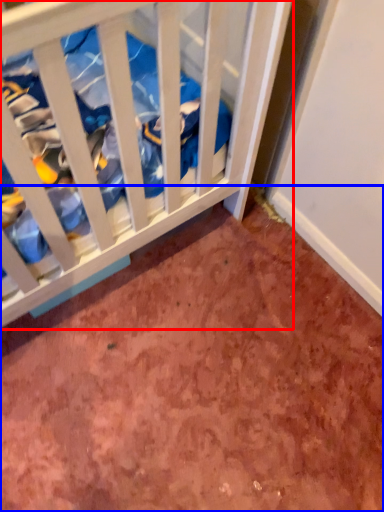
Question: Which of the following is the closest to the observer, infant bed (highlighted by a red box) or dirt (highlighted by a blue box)?

Choices:
 (A) infant bed
 (B) dirt

Answer: (A)